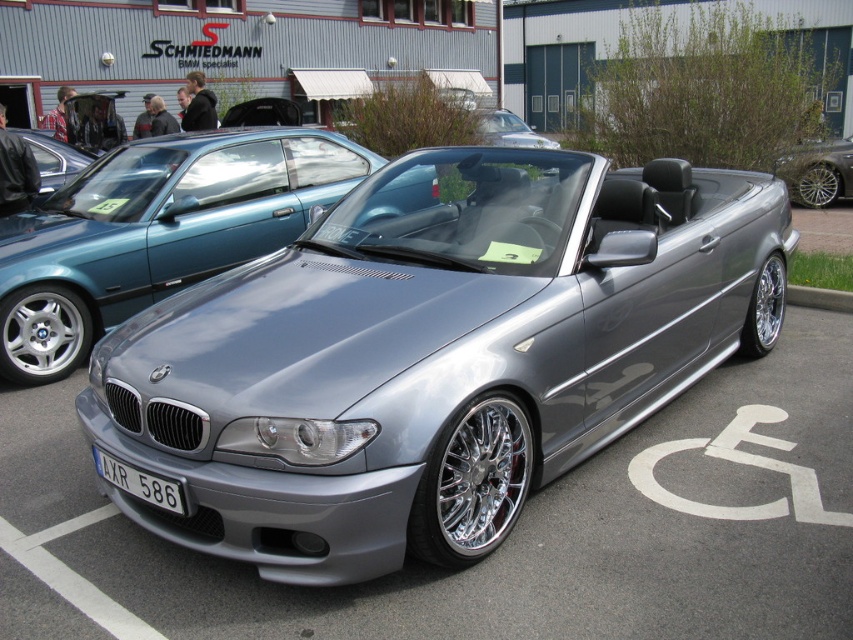
Question: Can you confirm if silver metallic car at right is wider than white plastic license plate at lower center?

Choices:
 (A) no
 (B) yes

Answer: (B)

Question: Observing the image, what is the correct spatial positioning of satin silver convertible at center in reference to white plastic license plate at lower center?

Choices:
 (A) left
 (B) right

Answer: (A)

Question: Which point is closer to the camera?

Choices:
 (A) satin silver convertible at center
 (B) silver metallic car at right
 (C) white plastic license plate at lower center

Answer: (C)

Question: Is satin silver convertible at center thinner than white plastic license plate at lower center?

Choices:
 (A) no
 (B) yes

Answer: (A)

Question: Which object is the closest to the silver metallic car at right?

Choices:
 (A) satin silver convertible at center
 (B) white plastic license plate at lower center

Answer: (A)

Question: Which is farther from the silver metallic car at right?

Choices:
 (A) satin silver convertible at center
 (B) white plastic license plate at lower center

Answer: (B)